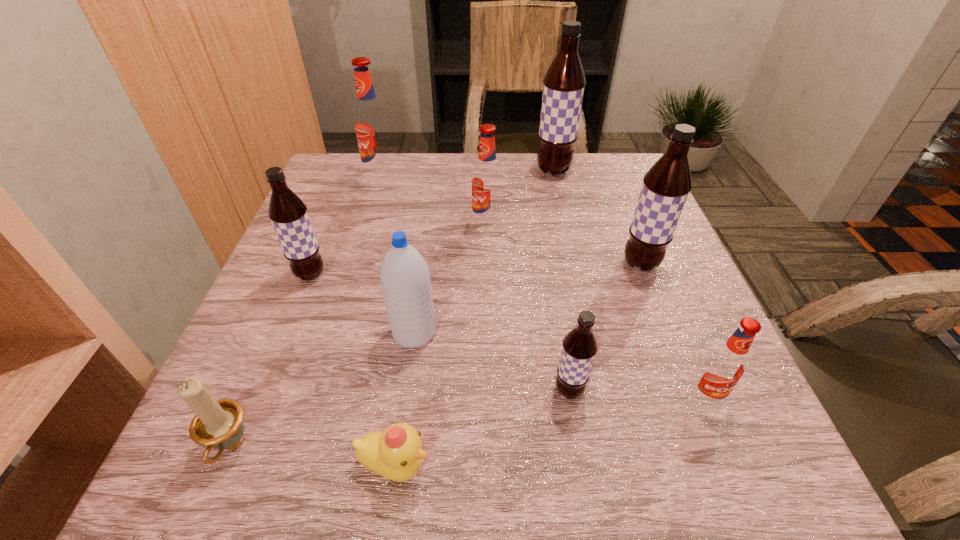
You are a GUI agent. You are given a task and a screenshot of the screen. Output one action in this format:
    pyautogui.click(x=<x>, y=<y>)
    Task: Click on the tallest object
    
    Given the screenshot: What is the action you would take?
    pyautogui.click(x=564, y=82)

Locate an element on the screen. The height and width of the screenshot is (540, 960). the tallest root beer is located at coordinates (564, 82).

Identify the location of the third object from left to right. This screenshot has height=540, width=960. (371, 124).

You are a GUI agent. You are given a task and a screenshot of the screen. Output one action in this format:
    pyautogui.click(x=<x>, y=<y>)
    Task: Click on the biggest red root beer
    The width and height of the screenshot is (960, 540).
    Given the screenshot: What is the action you would take?
    pyautogui.click(x=371, y=124)

Find the location of `the rightmost brown root beer`. the rightmost brown root beer is located at coordinates (666, 186).

At what (x,y) coordinates should I click in order to perform the action: click on the second farthest red root beer. Please return your answer as a coordinate pair (x, y). Looking at the image, I should click on (486, 179).

Locate an element on the screen. The width and height of the screenshot is (960, 540). the third farthest object is located at coordinates (486, 179).

Where is `the leftmost root beer`? This screenshot has width=960, height=540. the leftmost root beer is located at coordinates (288, 213).

Where is `the leftmost brown root beer`? The width and height of the screenshot is (960, 540). the leftmost brown root beer is located at coordinates (288, 213).

I want to click on the fifth nearest object, so click(405, 279).